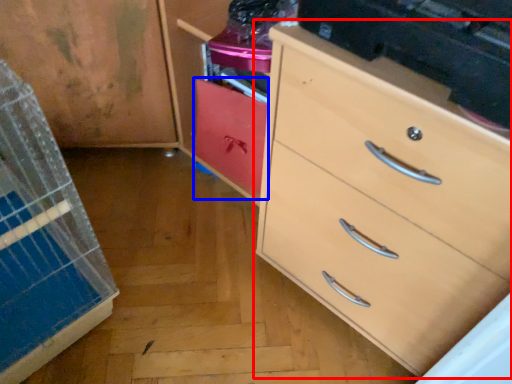
Question: Among these objects, which one is farthest to the camera, chest of drawers (highlighted by a red box) or cabinetry (highlighted by a blue box)?

Choices:
 (A) chest of drawers
 (B) cabinetry

Answer: (B)